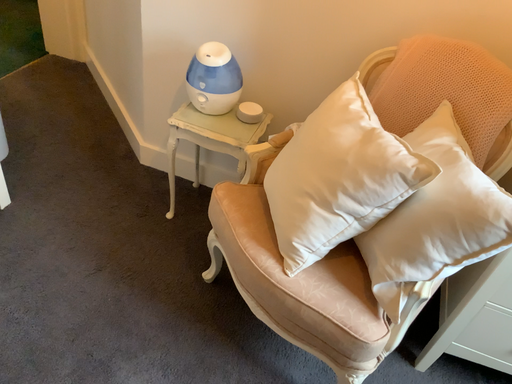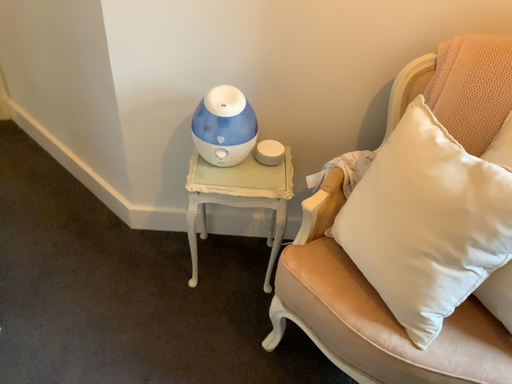
Question: How did the camera likely rotate when shooting the video?

Choices:
 (A) rotated right
 (B) rotated left

Answer: (A)